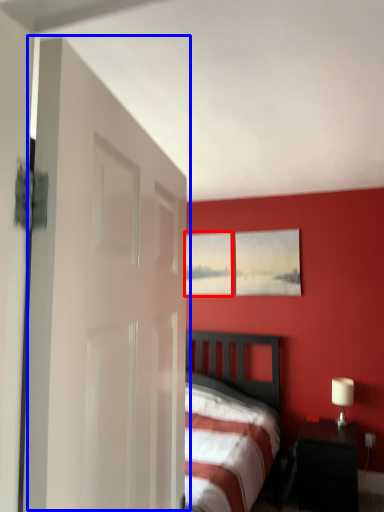
Question: Which of the following is the closest to the observer, picture frame (highlighted by a red box) or door (highlighted by a blue box)?

Choices:
 (A) picture frame
 (B) door

Answer: (B)